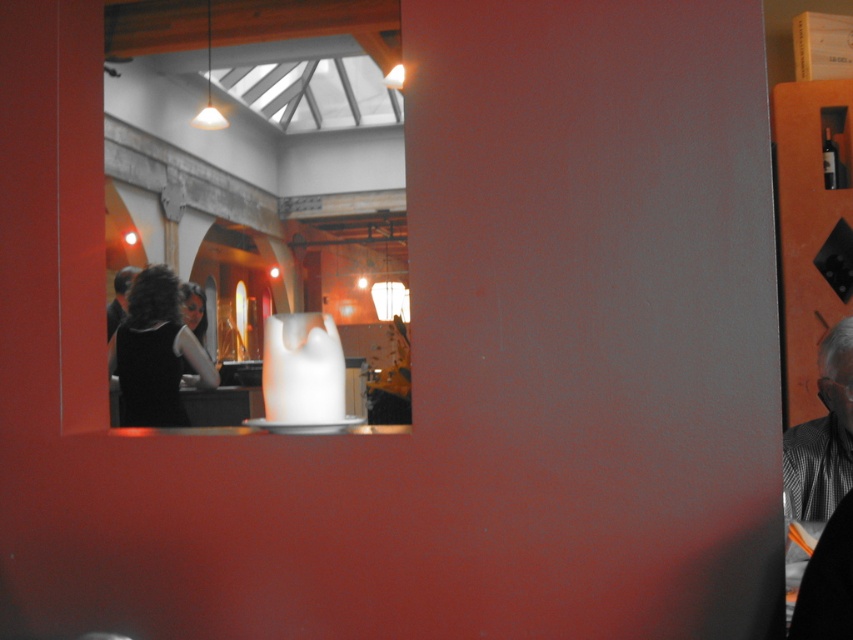
You are a fashion designer observing a model wearing the black matte dress at lower left and noticing the dark brown hair at left. Which of these two items is taller?

The black matte dress at lower left is taller than the dark brown hair at left.

You are a photographer trying to capture a candid shot of the gray checkered shirt at right and the black matte dress at lower left through the window. Since you want to ensure both are fully visible in the frame, which one might you need to adjust your focus on to include more of its height?

The gray checkered shirt at right is not as tall as the black matte dress at lower left, so you should focus more on the black matte dress at lower left to ensure its full height is captured in the photo.

You are a photographer trying to capture a candid shot of two people in the scene. The gray checkered shirt at right and the dark brown hair at left are both in your frame. Which subject should you focus on if you want to ensure the taller one is in sharp focus?

The gray checkered shirt at right is taller than the dark brown hair at left, so you should focus on the gray checkered shirt at right to ensure the taller subject is in sharp focus.